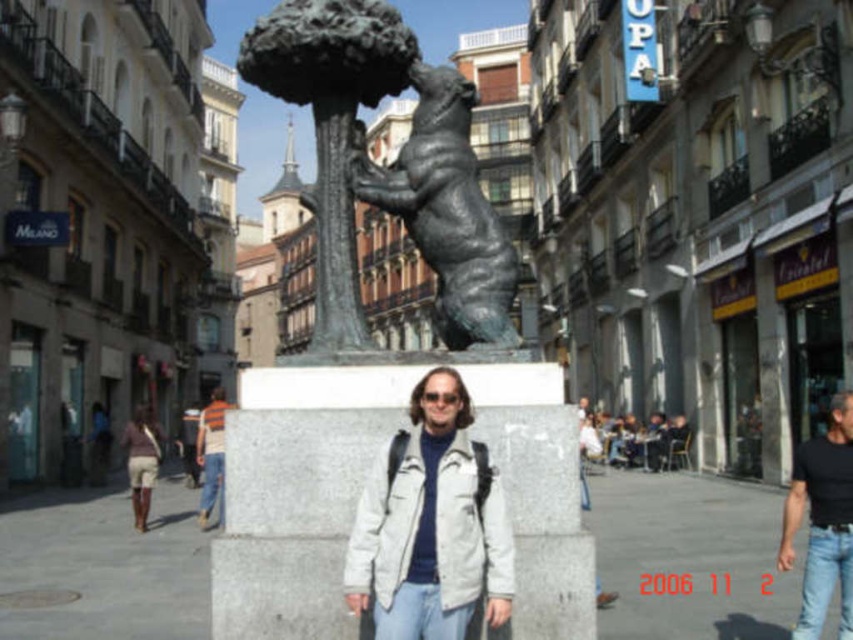
Which is more to the left, black cotton shirt at lower right or striped shirt at center?

Positioned to the left is striped shirt at center.

Between point (834, 508) and point (219, 392), which one is positioned behind?

Point (219, 392)

Identify the location of black cotton shirt at lower right. The height and width of the screenshot is (640, 853). (822, 522).

At what (x,y) coordinates should I click in order to perform the action: click on black cotton shirt at lower right. Please return your answer as a coordinate pair (x, y). This screenshot has height=640, width=853. Looking at the image, I should click on (822, 522).

Can you confirm if light gray fabric jacket at center is wider than bronze bear at center?

No.

Locate an element on the screen. light gray fabric jacket at center is located at coordinates (431, 525).

Is point (427, 420) behind point (432, 83)?

No.

The width and height of the screenshot is (853, 640). I want to click on light gray fabric jacket at center, so click(x=431, y=525).

From the picture: Does light gray fabric jacket at center appear on the left side of beige shorts at lower left?

No, light gray fabric jacket at center is not to the left of beige shorts at lower left.

Who is taller, light gray fabric jacket at center or beige shorts at lower left?

light gray fabric jacket at center is taller.

Does point (381, 518) come in front of point (141, 429)?

Yes, it is.

Locate an element on the screen. light gray fabric jacket at center is located at coordinates (431, 525).